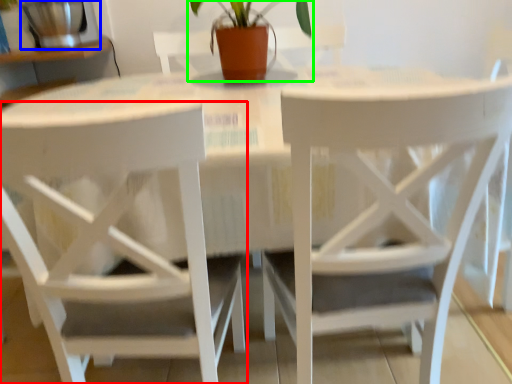
Question: Which object is positioned closest to chair (highlighted by a red box)? Select from appliance (highlighted by a blue box) and houseplant (highlighted by a green box).

Choices:
 (A) appliance
 (B) houseplant

Answer: (B)